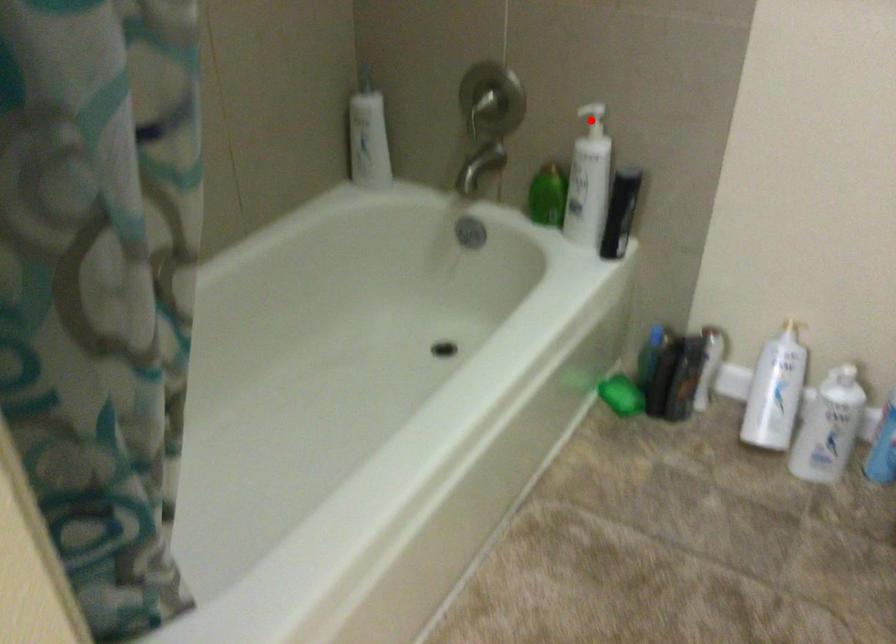
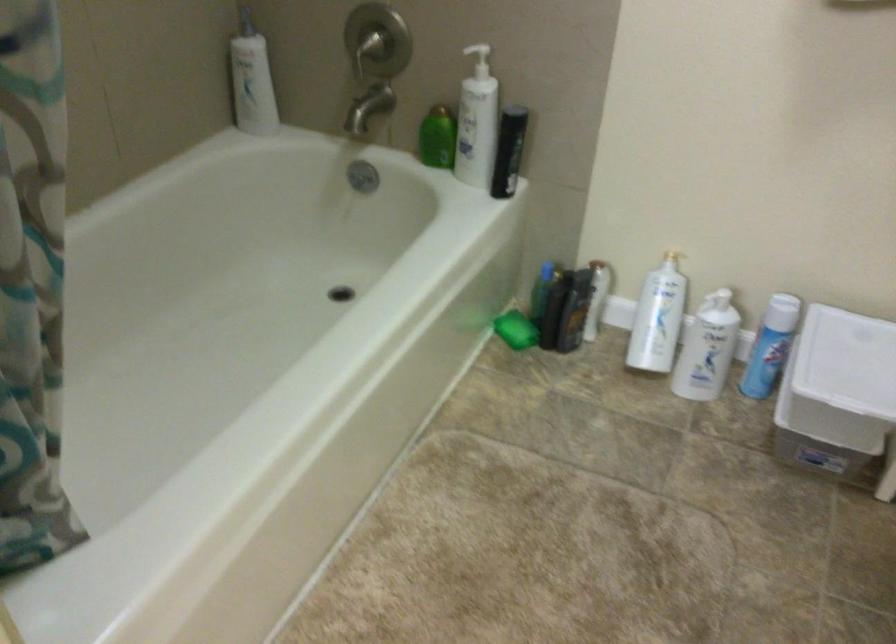
Where in the second image is the point corresponding to the highlighted location from the first image?

(478, 57)